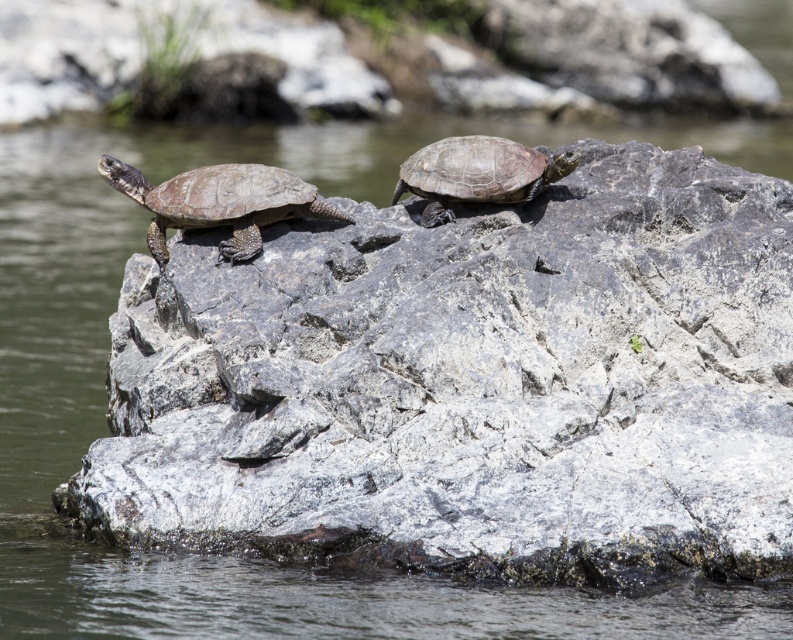
You are a photographer trying to capture both the matte brown tortoise at left and the matte brown tortoise at center on a single photo. Since you want to include both in the frame, which direction should you position your camera relative to the rock to ensure both tortoises are visible?

You should position your camera to the left of the rock so that both the matte brown tortoise at left and the matte brown tortoise at center are visible in the frame.

You are a nature photographer planning to take a closeup shot of both the matte brown tortoise at left and the matte brown tortoise at center. Since you want to capture their size difference clearly, which tortoise should you focus on first to ensure proper framing?

The matte brown tortoise at center is larger than the matte brown tortoise at left, so you should focus on the matte brown tortoise at center first to highlight the size difference between them.

In the scene shown: You are a drone operator trying to capture a photo of the two turtles on the rock. You need to position your drone so that it can fly directly above the first turtle at point (234,221) and then move to the second turtle at point (497,202). From the perspective of someone standing at the edge of the water looking towards the rock, which turtle will the drone pass over first?

The drone will pass over the first turtle at point (234,221) first because it is positioned in front of the second turtle at point (497,202) from the observer perspective.